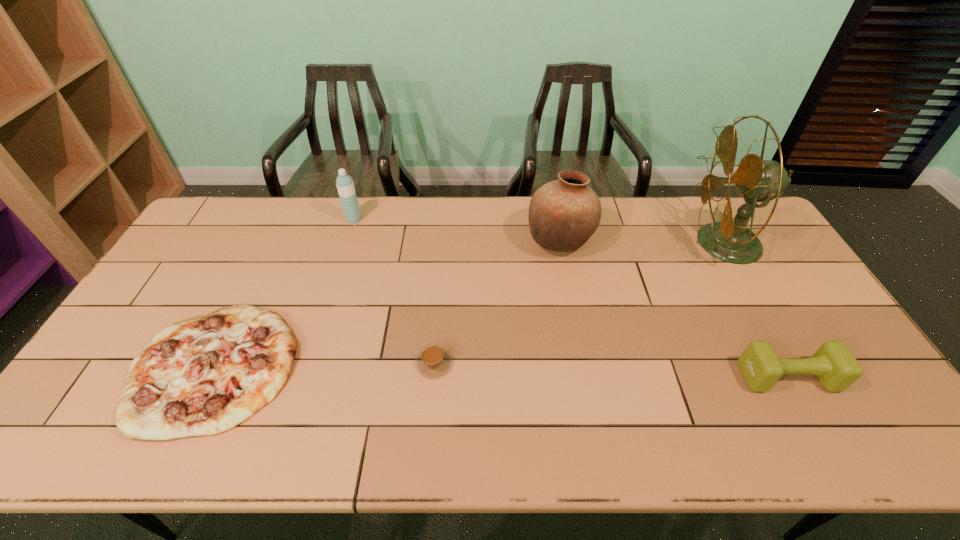
Identify the location of the tallest object. (757, 180).

Locate an element on the screen. pottery is located at coordinates (563, 214).

The height and width of the screenshot is (540, 960). In order to click on the fifth shortest object in this screenshot , I will do `click(563, 214)`.

The width and height of the screenshot is (960, 540). In order to click on the fourth shortest object in this screenshot , I will do `click(345, 186)`.

Find the location of `the fifth object from right to left`. the fifth object from right to left is located at coordinates (345, 186).

This screenshot has width=960, height=540. I want to click on dumbbell, so click(x=836, y=368).

I want to click on the third object from left to right, so click(433, 361).

The height and width of the screenshot is (540, 960). What are the coordinates of `pizza` in the screenshot? It's located at (203, 376).

This screenshot has width=960, height=540. What are the coordinates of `vacant point located 0.260m in front of the tallest object, directing air flow` in the screenshot? It's located at (613, 243).

Where is `vacant position located in front of the tallest object, directing air flow`? This screenshot has height=540, width=960. vacant position located in front of the tallest object, directing air flow is located at coordinates (619, 243).